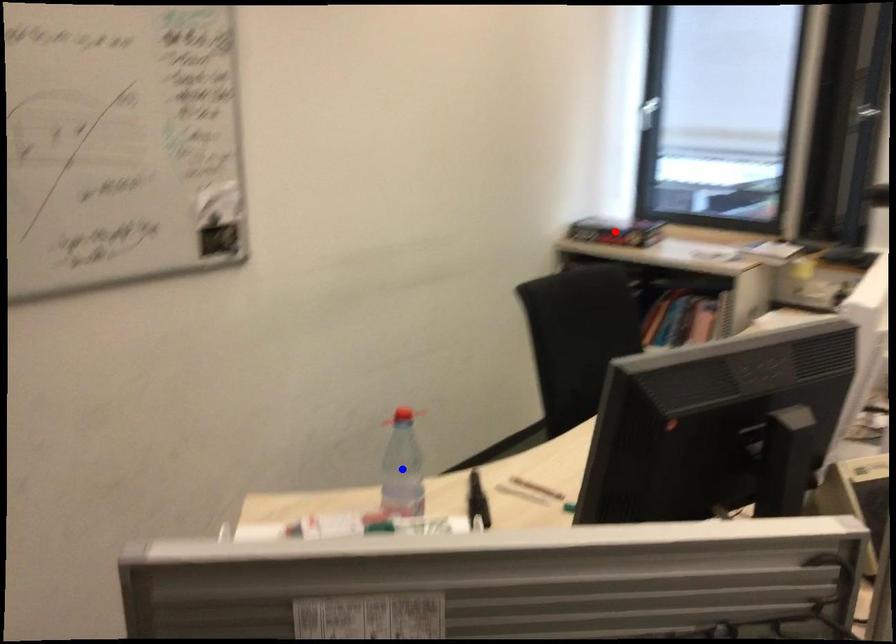
Question: Which of the two points in the image is closer to the camera?

Choices:
 (A) Blue point is closer.
 (B) Red point is closer.

Answer: (A)